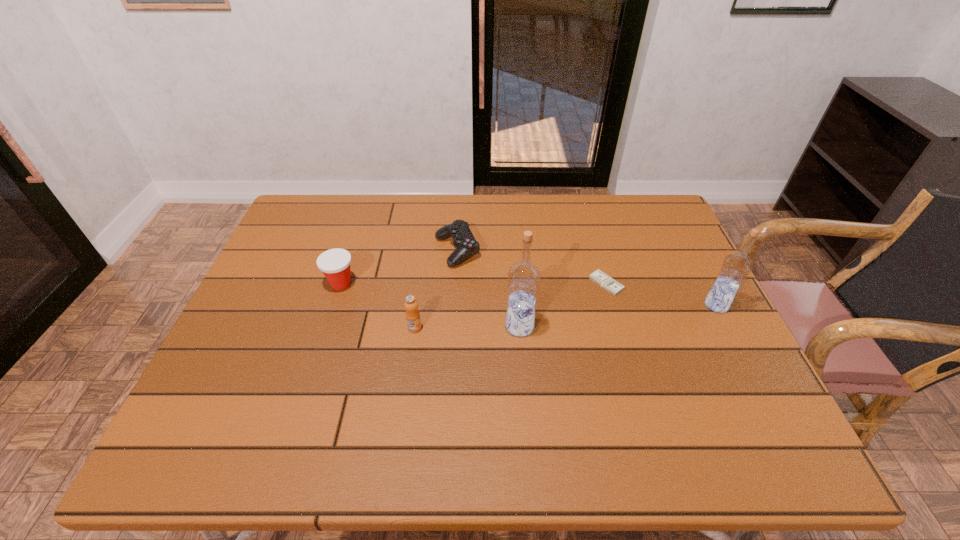
Find the location of a particular element. The image size is (960, 540). the fourth object from left to right is located at coordinates (524, 277).

Locate an element on the screen. The image size is (960, 540). the left vodka is located at coordinates (524, 277).

Locate an element on the screen. The height and width of the screenshot is (540, 960). the farther vodka is located at coordinates (735, 268).

You are a GUI agent. You are given a task and a screenshot of the screen. Output one action in this format:
    pyautogui.click(x=<x>, y=<y>)
    Task: Click on the right vodka
    
    Given the screenshot: What is the action you would take?
    pyautogui.click(x=735, y=268)

At what (x,y) coordinates should I click in order to perform the action: click on the shortest object. Please return your answer as a coordinate pair (x, y). Looking at the image, I should click on (608, 283).

Image resolution: width=960 pixels, height=540 pixels. What are the coordinates of `money` in the screenshot? It's located at (608, 283).

Identify the location of Dixie cup. This screenshot has width=960, height=540. (335, 263).

I want to click on the leftmost object, so click(x=335, y=263).

At what (x,y) coordinates should I click in order to perform the action: click on control. Please return your answer as a coordinate pair (x, y). Looking at the image, I should click on (464, 241).

Identify the location of the fifth tallest object. (464, 241).